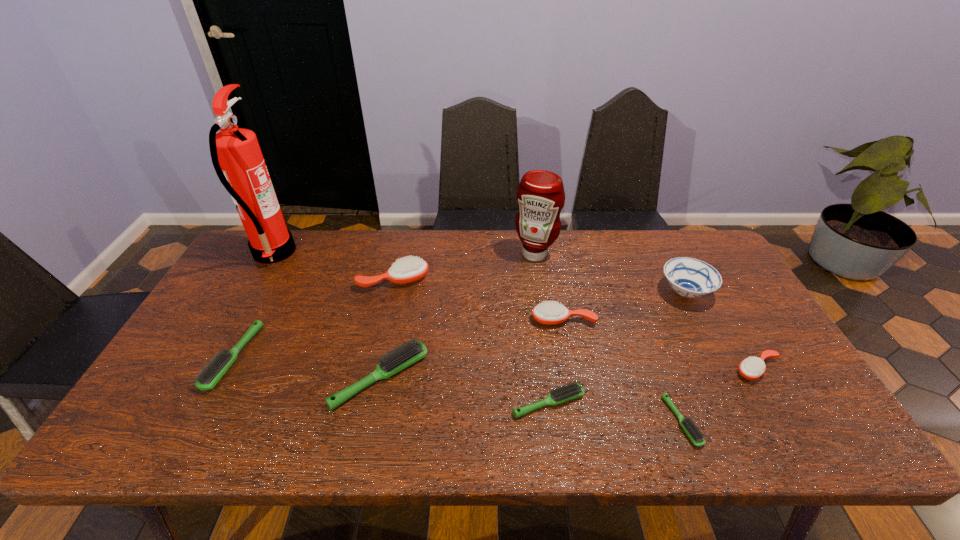
I want to click on the tallest object, so click(235, 152).

Where is `red fire extinguisher`? red fire extinguisher is located at coordinates (235, 152).

You are a GUI agent. You are given a task and a screenshot of the screen. Output one action in this format:
    pyautogui.click(x=<x>, y=<y>)
    Task: Click on the condiment
    
    Given the screenshot: What is the action you would take?
    pyautogui.click(x=540, y=194)

The image size is (960, 540). Identify the location of red condiment. (540, 194).

The image size is (960, 540). Find the location of `soup bowl`. soup bowl is located at coordinates (689, 277).

Find the location of a particular element. Image resolution: width=960 pixels, height=540 pixels. the tallest hairbrush is located at coordinates (411, 269).

I want to click on the farthest hairbrush, so click(x=411, y=269).

This screenshot has width=960, height=540. Find the location of `the second smallest orange hairbrush`. the second smallest orange hairbrush is located at coordinates (550, 313).

You are a GUI agent. You are given a task and a screenshot of the screen. Output one action in this format:
    pyautogui.click(x=<x>, y=<y>)
    Task: Click on the second farthest orange hairbrush
    This screenshot has height=540, width=960.
    Given the screenshot: What is the action you would take?
    pyautogui.click(x=550, y=313)

I want to click on the biggest light hairbrush, so click(411, 351).